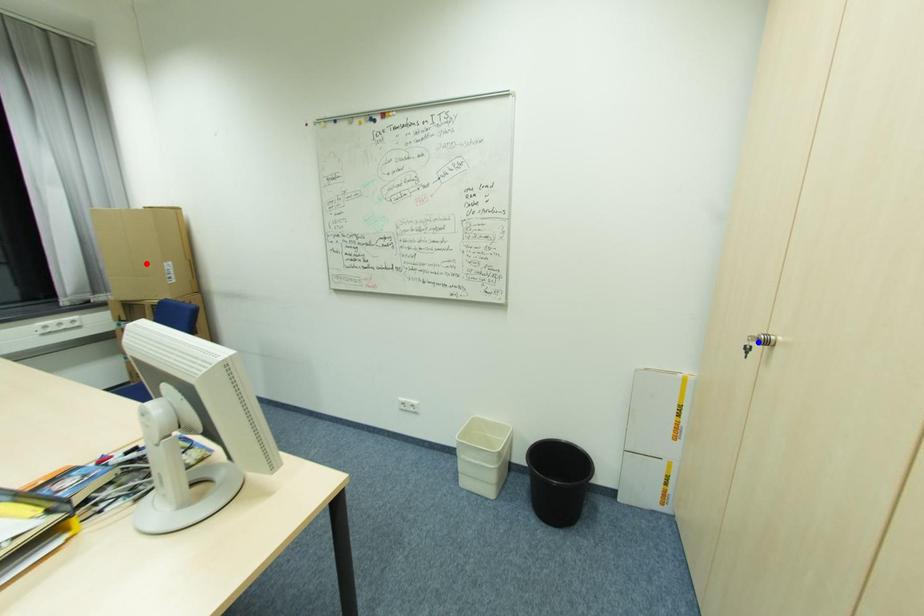
Question: In the image, two points are highlighted. Which point is nearer to the camera? Reply with the corresponding letter.

Choices:
 (A) blue point
 (B) red point

Answer: (A)